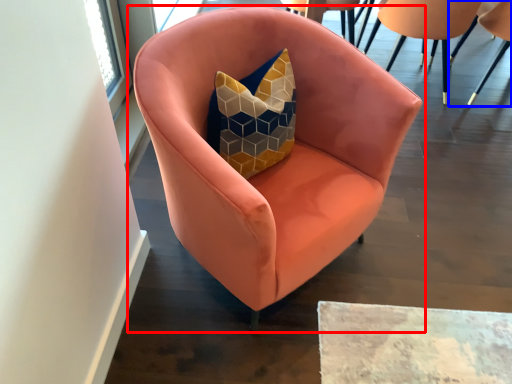
Question: Among these objects, which one is farthest to the camera, chair (highlighted by a red box) or chair (highlighted by a blue box)?

Choices:
 (A) chair
 (B) chair

Answer: (B)